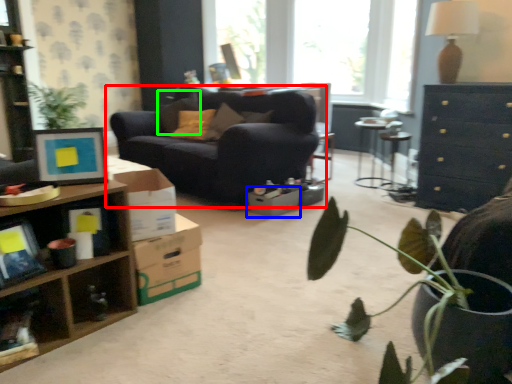
Question: Based on their relative distances, which object is farther from studio couch (highlighted by a red box)? Choose from cardboard box (highlighted by a blue box) and pillow (highlighted by a green box).

Choices:
 (A) cardboard box
 (B) pillow

Answer: (B)